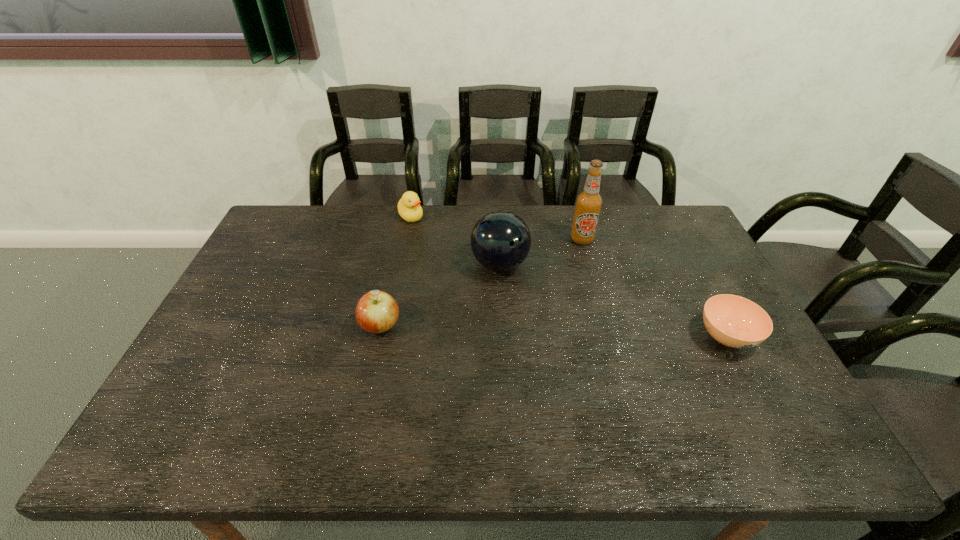
Locate an element on the screen. Image resolution: width=960 pixels, height=540 pixels. apple is located at coordinates (376, 312).

Find the location of a particular element. This screenshot has width=960, height=540. the shortest object is located at coordinates (734, 321).

You are a GUI agent. You are given a task and a screenshot of the screen. Output one action in this format:
    pyautogui.click(x=<x>, y=<y>)
    Task: Click on the soup bowl
    This screenshot has height=540, width=960.
    Given the screenshot: What is the action you would take?
    734,321

The image size is (960, 540). I want to click on beer bottle, so click(x=589, y=202).

At what (x,y) coordinates should I click in order to perform the action: click on the second object from right to left. Please return your answer as a coordinate pair (x, y). The image size is (960, 540). Looking at the image, I should click on (589, 202).

The width and height of the screenshot is (960, 540). I want to click on the second tallest object, so click(x=500, y=240).

I want to click on bowling ball, so click(500, 240).

In order to click on the farthest object in this screenshot , I will do `click(409, 208)`.

Locate an element on the screen. vacant space located 0.300m on the back of the apple is located at coordinates (398, 246).

The height and width of the screenshot is (540, 960). I want to click on free space located on the front of the rightmost object, so click(752, 384).